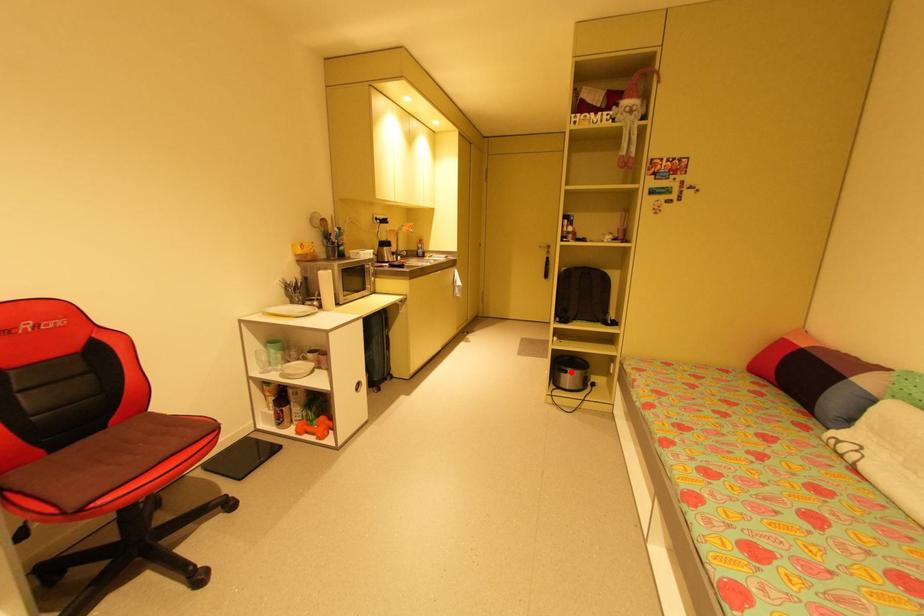
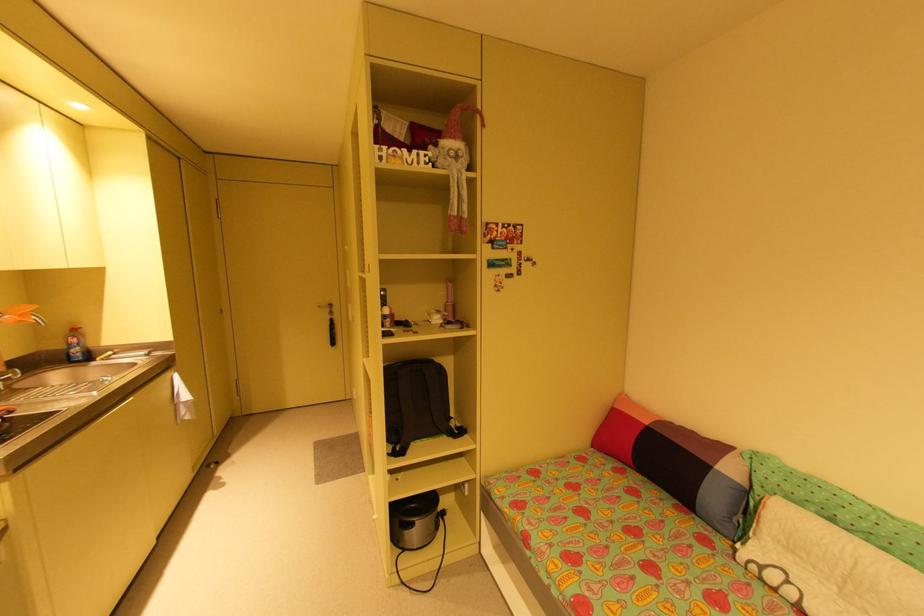
Where in the second image is the point corresponding to the highlighted location from the first image?

(417, 525)